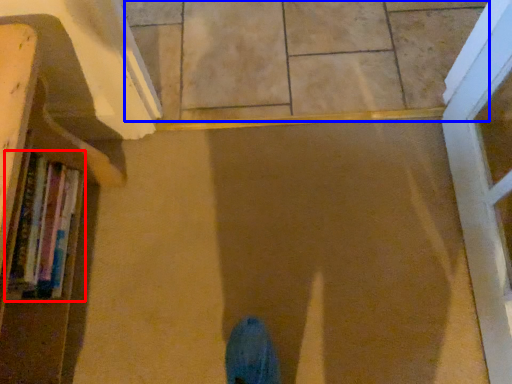
Question: Which object is further to the camera taking this photo, book (highlighted by a red box) or tile (highlighted by a blue box)?

Choices:
 (A) book
 (B) tile

Answer: (B)